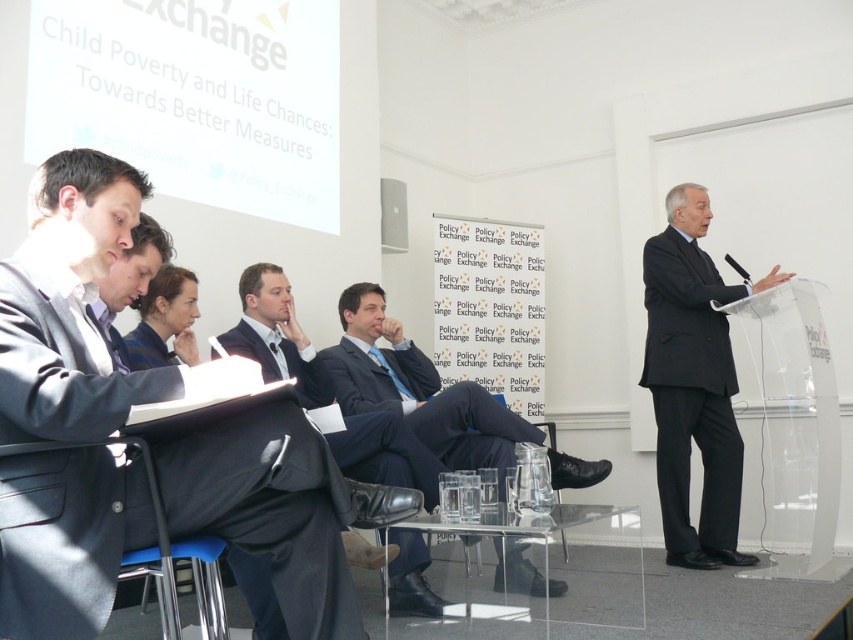
Who is taller, matte black suit at center or dark blue suit at center?

dark blue suit at center is taller.

Who is positioned more to the right, matte black suit at center or dark blue suit at center?

matte black suit at center is more to the right.

Image resolution: width=853 pixels, height=640 pixels. I want to click on matte black suit at center, so click(416, 388).

Can you confirm if matte black suit at left is thinner than matte black suit at center?

Yes.

Where is `matte black suit at left`? matte black suit at left is located at coordinates (270, 509).

What are the coordinates of `matte black suit at left` in the screenshot? It's located at (270, 509).

Where is `matte black suit at left`? The width and height of the screenshot is (853, 640). matte black suit at left is located at coordinates (270, 509).

Is matte black suit at left below black matte suit at right?

Yes.

Is matte black suit at left behind black matte suit at right?

No, it is in front of black matte suit at right.

The image size is (853, 640). What do you see at coordinates (270, 509) in the screenshot?
I see `matte black suit at left` at bounding box center [270, 509].

Where is `matte black suit at left`? This screenshot has width=853, height=640. matte black suit at left is located at coordinates (270, 509).